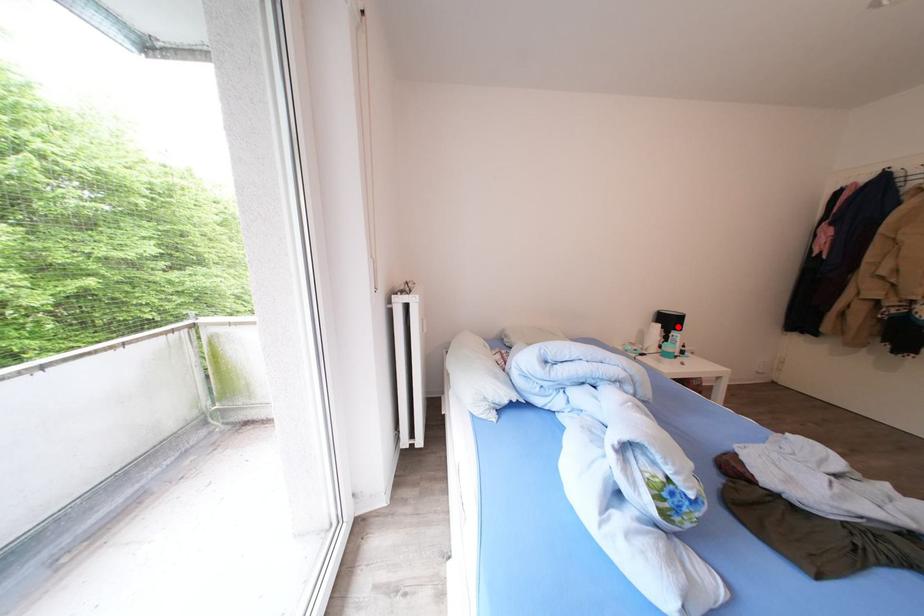
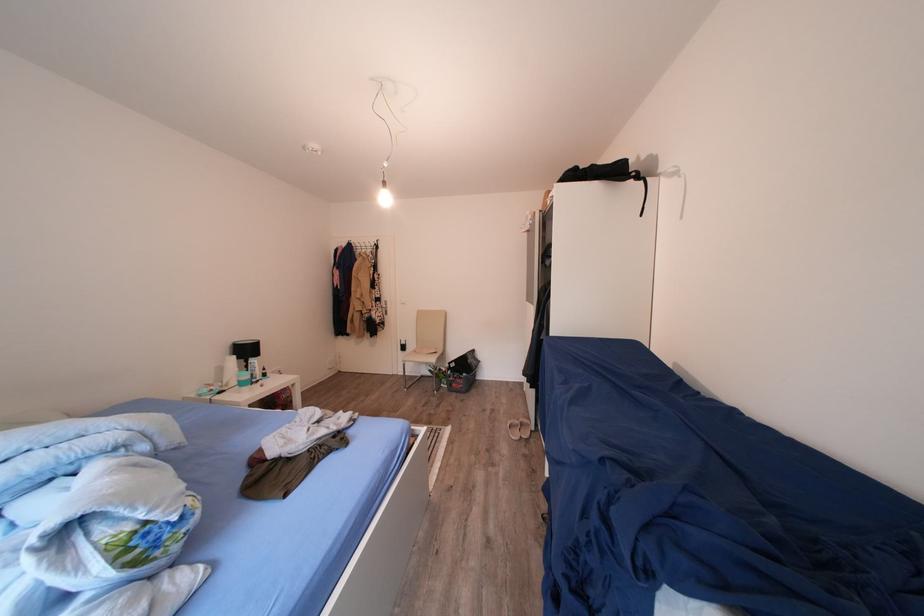
Locate, in the second image, the point that corresponds to the highlighted location in the first image.

(256, 355)